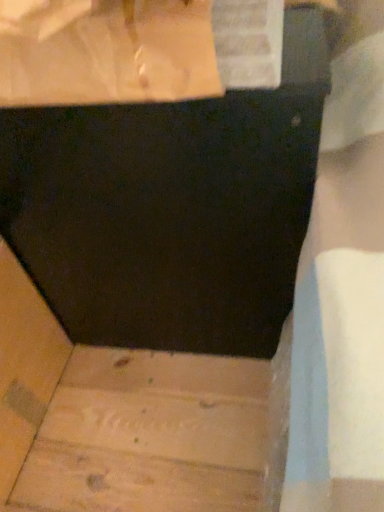
Measure the distance between point (242, 274) and camera.

Point (242, 274) and camera are 27.28 inches apart.

In order to face matte black cabinet at center, should I rotate leftwards or rightwards?

Rotate your view left by about 2.461°.

Describe the element at coordinates (171, 208) in the screenshot. I see `matte black cabinet at center` at that location.

Where is `matte black cabinet at center`? Image resolution: width=384 pixels, height=512 pixels. matte black cabinet at center is located at coordinates (171, 208).

The image size is (384, 512). Find the location of `matte black cabinet at center`. matte black cabinet at center is located at coordinates [x=171, y=208].